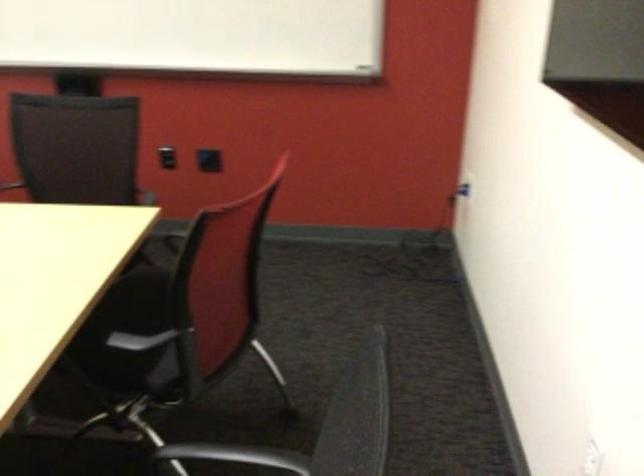
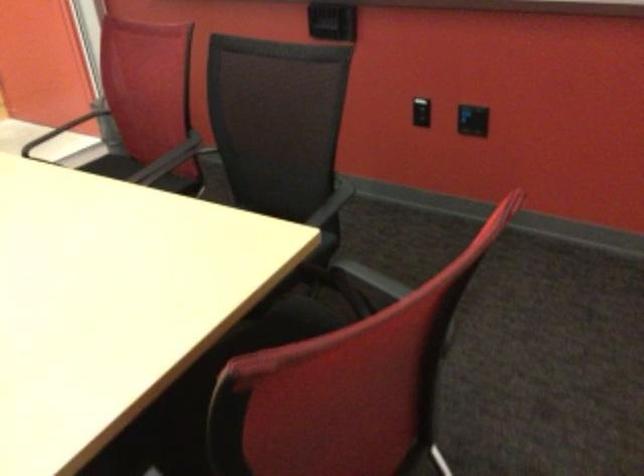
Question: How did the camera likely rotate?

Choices:
 (A) Left
 (B) Right
 (C) Up
 (D) Down

Answer: (A)